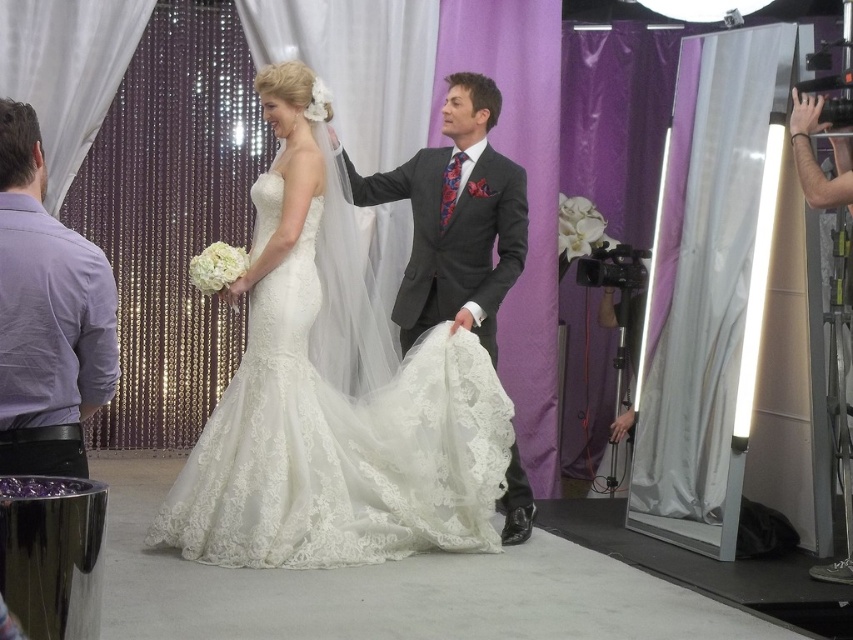
You are a photographer setting up for a photoshoot. You notice the purple cotton shirt at left and the matte gray suit at center in the scene. Which item is positioned nearer to you as you prepare the shot?

The purple cotton shirt at left is closer to the viewer than the matte gray suit at center, so the purple cotton shirt at left is positioned nearer to you.

In the wedding photo shoot scene, the bride is wearing a lace fabric dress at center and the groom is wearing a matte gray suit at center. Which clothing item is located more to the left side?

The lace fabric dress at center is positioned on the left side of the matte gray suit at center, so the lace fabric dress at center is more to the left.

The bride is wearing a lace fabric dress at center. The groom is standing beside her. How far apart are the bride and groom?

The bride and groom are 3.80 meters apart.